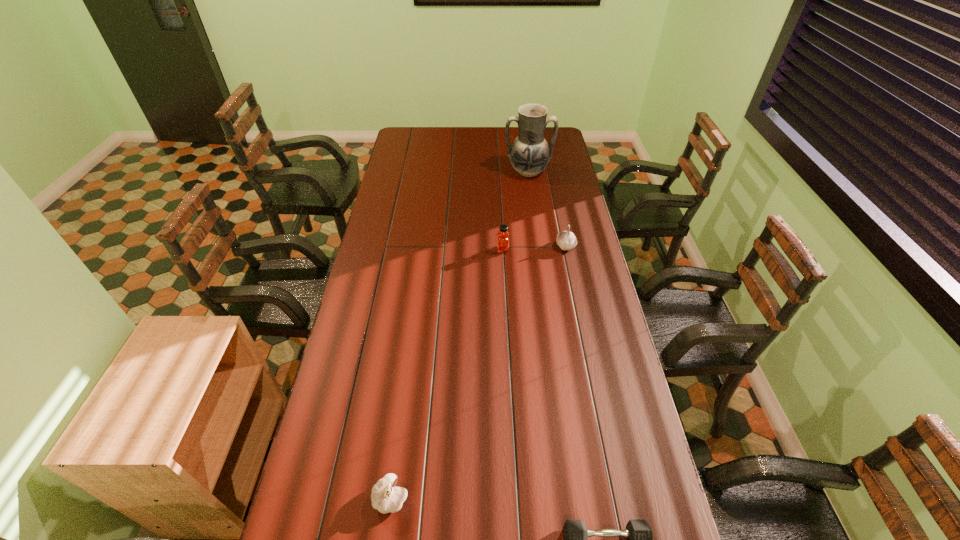
You are a GUI agent. You are given a task and a screenshot of the screen. Output one action in this format:
    pyautogui.click(x=<x>, y=<y>)
    Task: Click on the vacant space that is in between the farthest object and the second object from left to right
    
    Given the screenshot: What is the action you would take?
    pyautogui.click(x=516, y=211)

Identify the location of unoccupied area between the farther garlic and the nearer garlic. click(x=478, y=372).

At what (x,y) coordinates should I click in order to perform the action: click on vacant point located between the right garlic and the fourth object from right to left. Please return your answer as a coordinate pair (x, y). This screenshot has height=540, width=960. Looking at the image, I should click on (534, 248).

Identify the location of free space that is in between the fourth object from right to left and the right garlic. The width and height of the screenshot is (960, 540). (534, 248).

Identify the location of object that is the second closest one to the shortest object. (502, 236).

Where is `object that stands as the closest to the second nearest object`? object that stands as the closest to the second nearest object is located at coordinates (638, 532).

Identify the location of free space that satisfies the following two spatial constraints: 1. on the front-facing side of the farthest object; 2. on the right side of the right garlic. (539, 246).

Image resolution: width=960 pixels, height=540 pixels. Find the location of `free space that satisfies the following two spatial constraints: 1. on the front-facing side of the farther garlic; 2. on the left side of the farthest object`. free space that satisfies the following two spatial constraints: 1. on the front-facing side of the farther garlic; 2. on the left side of the farthest object is located at coordinates (539, 246).

The height and width of the screenshot is (540, 960). In order to click on vacant space that satisfies the following two spatial constraints: 1. on the back side of the nearer garlic; 2. on the left side of the farther garlic in this screenshot , I will do `click(425, 246)`.

Image resolution: width=960 pixels, height=540 pixels. Find the location of `blank space that satisfies the following two spatial constraints: 1. on the front-facing side of the tallest object; 2. on the front label of the honey`. blank space that satisfies the following two spatial constraints: 1. on the front-facing side of the tallest object; 2. on the front label of the honey is located at coordinates (540, 249).